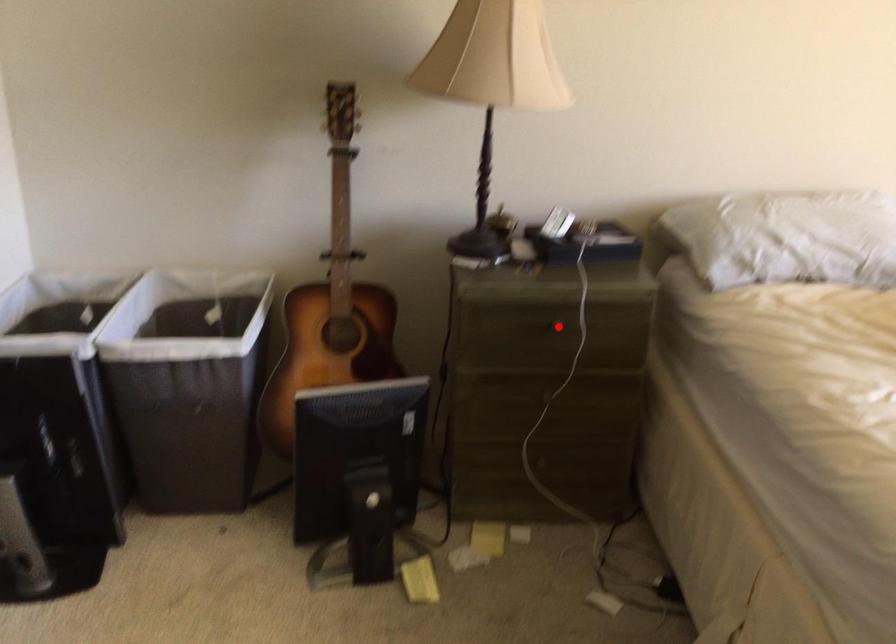
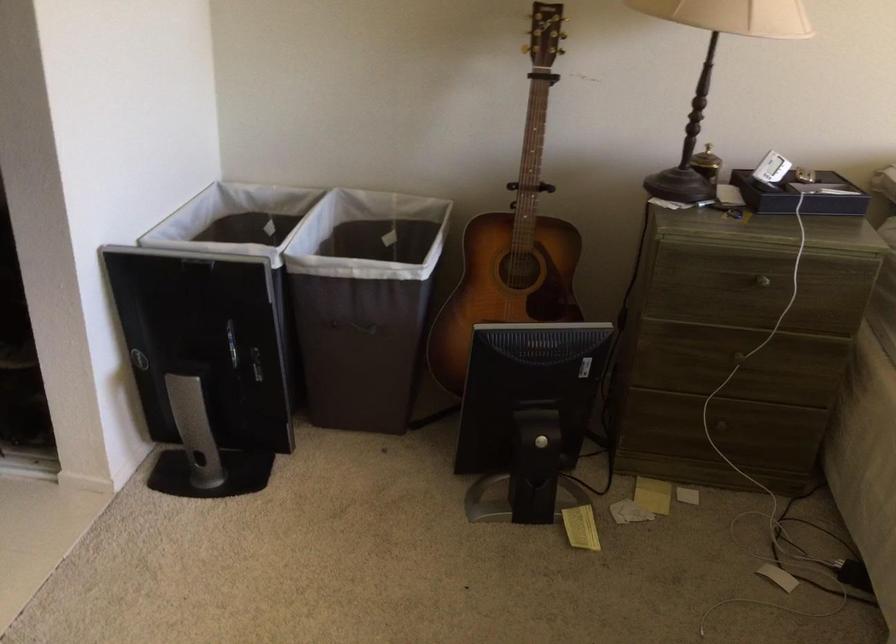
Question: I am providing you with two images of the same scene from different viewpoints. In image1, a red point is highlighted. Considering the same 3D point in image2, which of the following is correct?

Choices:
 (A) It is closer
 (B) It is farther

Answer: (A)